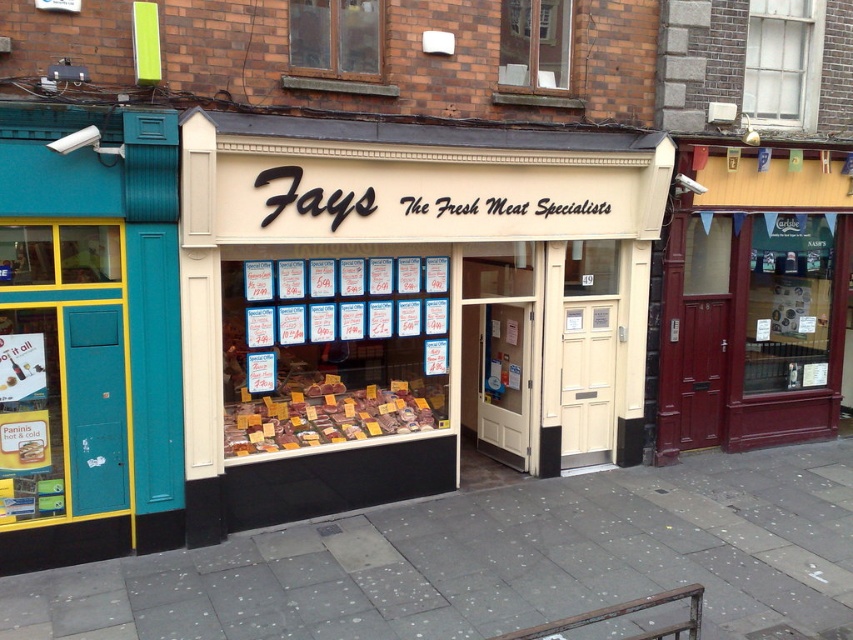
Does gray concrete pavement at center have a lesser width compared to meat with yellow labels at center?

In fact, gray concrete pavement at center might be wider than meat with yellow labels at center.

Locate an element on the screen. gray concrete pavement at center is located at coordinates (492, 561).